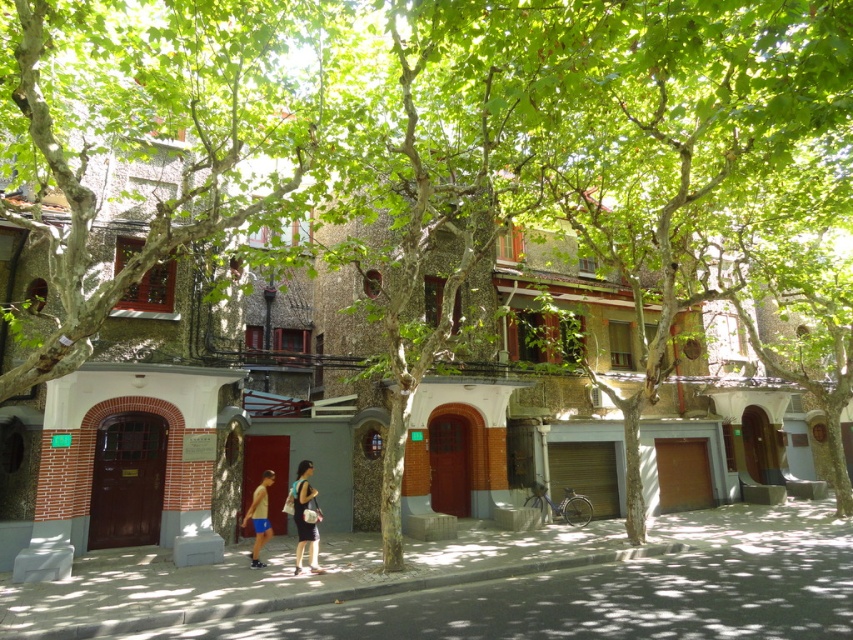
Is matte black shorts at center below matte black dress at center?

Yes.

Looking at this image, does matte black shorts at center have a greater height compared to matte black dress at center?

No, matte black shorts at center is not taller than matte black dress at center.

Where is `matte black shorts at center`? matte black shorts at center is located at coordinates (305, 516).

Image resolution: width=853 pixels, height=640 pixels. Identify the location of matte black shorts at center. (305, 516).

Measure the distance from matte black shorts at center to tan skin man at center.

matte black shorts at center is 25.86 inches away from tan skin man at center.

This screenshot has height=640, width=853. In order to click on matte black shorts at center in this screenshot , I will do `click(305, 516)`.

Where is `matte black shorts at center`? This screenshot has height=640, width=853. matte black shorts at center is located at coordinates (305, 516).

The width and height of the screenshot is (853, 640). Describe the element at coordinates (305, 516) in the screenshot. I see `matte black dress at center` at that location.

The width and height of the screenshot is (853, 640). What do you see at coordinates (305, 516) in the screenshot?
I see `matte black dress at center` at bounding box center [305, 516].

Locate an element on the screen. This screenshot has width=853, height=640. matte black dress at center is located at coordinates (305, 516).